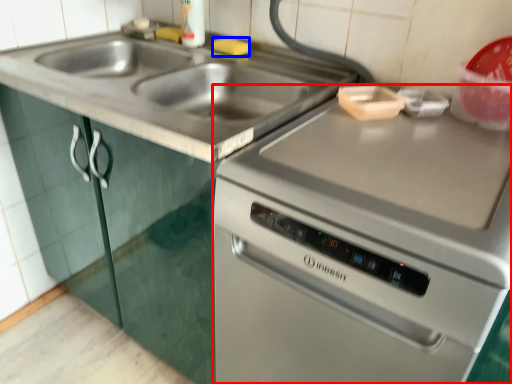
Question: Which object appears farthest to the camera in this image, oven (highlighted by a red box) or food (highlighted by a blue box)?

Choices:
 (A) oven
 (B) food

Answer: (B)